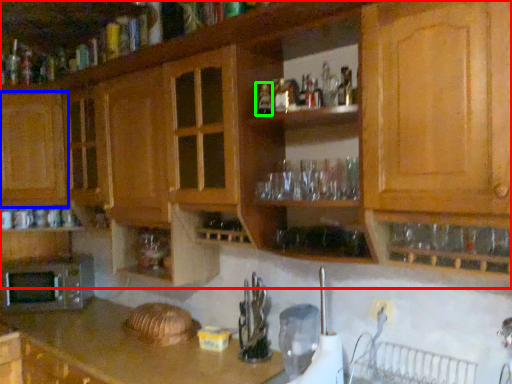
Question: Which object is the closest to the cabinetry (highlighted by a red box)? Choose among these: cabinetry (highlighted by a blue box) or bottle (highlighted by a green box).

Choices:
 (A) cabinetry
 (B) bottle

Answer: (A)